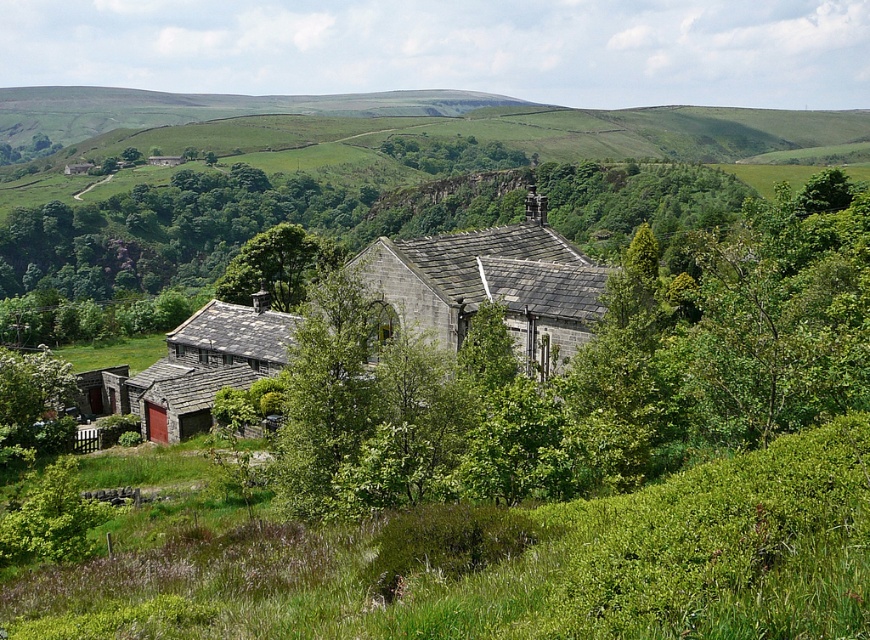
You are a gardener standing on the green leafy grass at lower center, and you need to water the gray stone building at center. Can you reach it with a standard 15 meter long garden hose?

The distance between the green leafy grass at lower center and the gray stone building at center is 15.36 meters. Since the hose is only 15 meters long, it is 0.36 meters too short to reach the building.

Based on the photo, you are standing at the center of the image and want to step onto the green leafy grass at lower center. Which direction should you move to reach it?

The green leafy grass at lower center is located at point (516, 564), so you should move downward and slightly to the right to reach it.